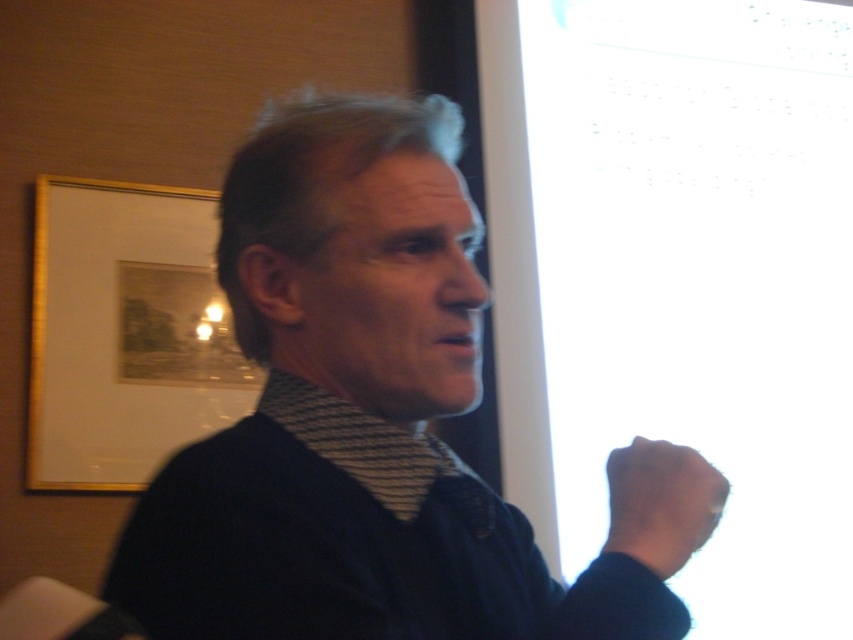
From the picture: You are an artist trying to sketch this scene. You need to decide the placement of the dark blue sweater at center and the black matte hand at lower right. Based on their sizes, which object should you draw first to ensure proper scaling?

The dark blue sweater at center is wider than the black matte hand at lower right, so you should draw the dark blue sweater at center first to ensure proper scaling.